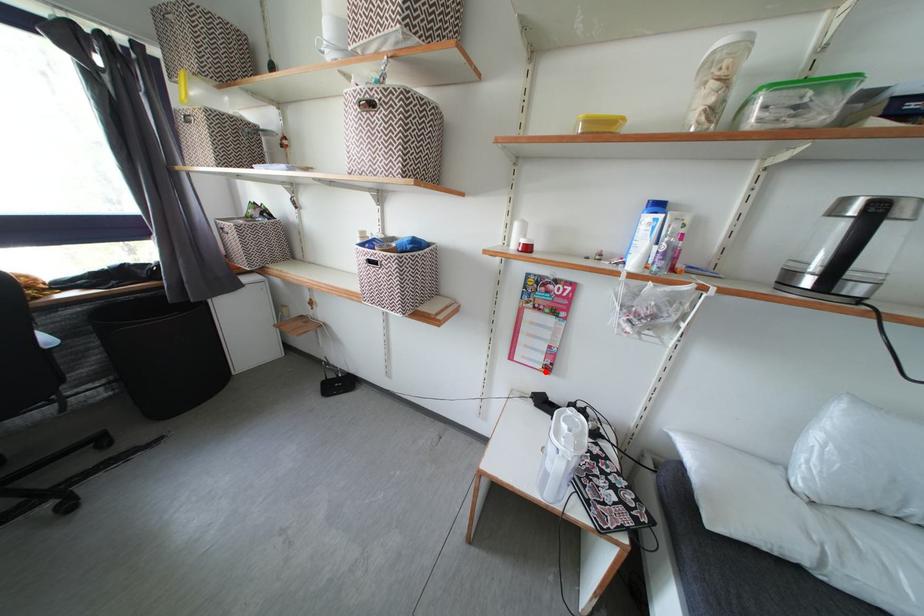
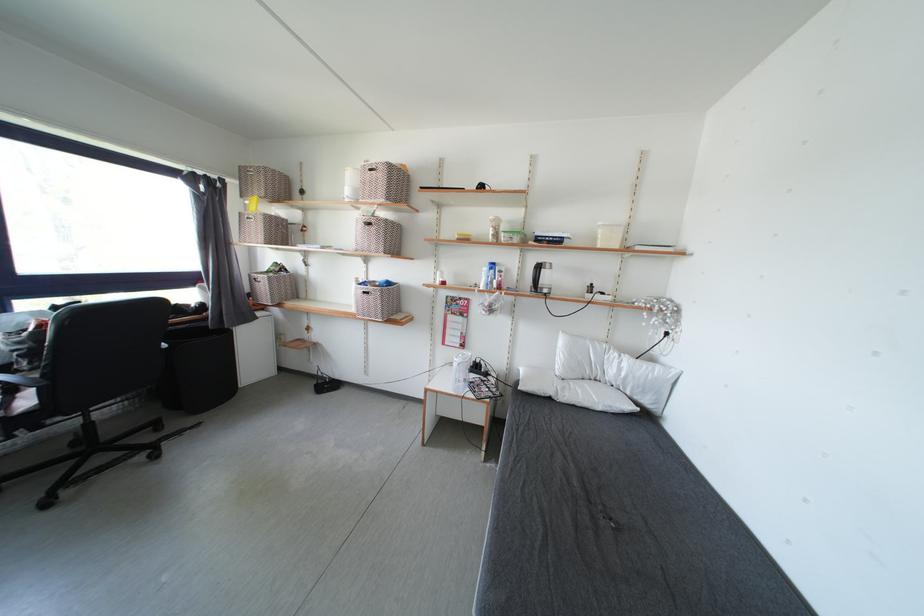
Where in the second image is the point corresponding to the highlighted location from the first image?

(465, 351)